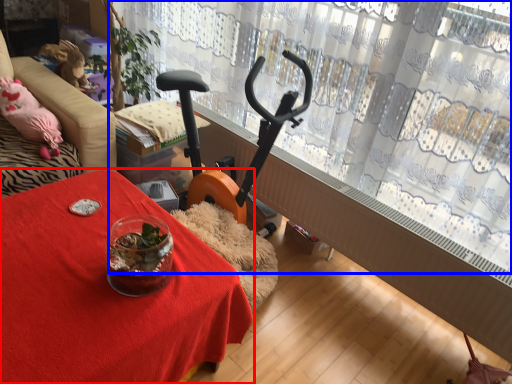
Question: Which object is further to the camera taking this photo, table (highlighted by a red box) or curtain (highlighted by a blue box)?

Choices:
 (A) table
 (B) curtain

Answer: (B)